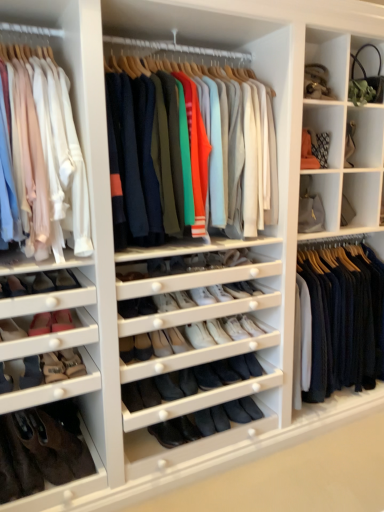
Question: Is suede black shoe at lower left, positioned as the 10th shoe in right-to-left order, situated inside leather boot at lower left or outside?

Choices:
 (A) outside
 (B) inside

Answer: (A)

Question: Is point (8, 375) closer or farther from the camera than point (48, 472)?

Choices:
 (A) farther
 (B) closer

Answer: (B)

Question: Estimate the real-world distances between objects in this image. Which object is closer to the suede brown shoe at lower left, the 4th shoe positioned from the right?

Choices:
 (A) matte white shirts at left, arranged as the first clothing when viewed from the left
 (B) black suede shoe at center, arranged as the third shoe when viewed from the right
 (C) black suede shoe at lower left, the fifth shoe viewed from the right
 (D) matte pink shoe at lower left, which is counted as the seventh shoe, starting from the right
 (E) black suede shoe at center, the 9th shoe from the left

Answer: (C)

Question: Based on their relative distances, which object is nearer to the matte pink shoe at lower left, placed as the fourth shoe when sorted from left to right?

Choices:
 (A) black suede shoe at center, arranged as the eighth shoe when viewed from the left
 (B) leather boot at lower left
 (C) knit sweater at center, acting as the 2th clothing starting from the left
 (D) matte pink shoe at lower left, positioned as the 6th shoe in right-to-left order
 (E) brown suede shoe at lower left, arranged as the 8th shoe when viewed from the right

Answer: (D)